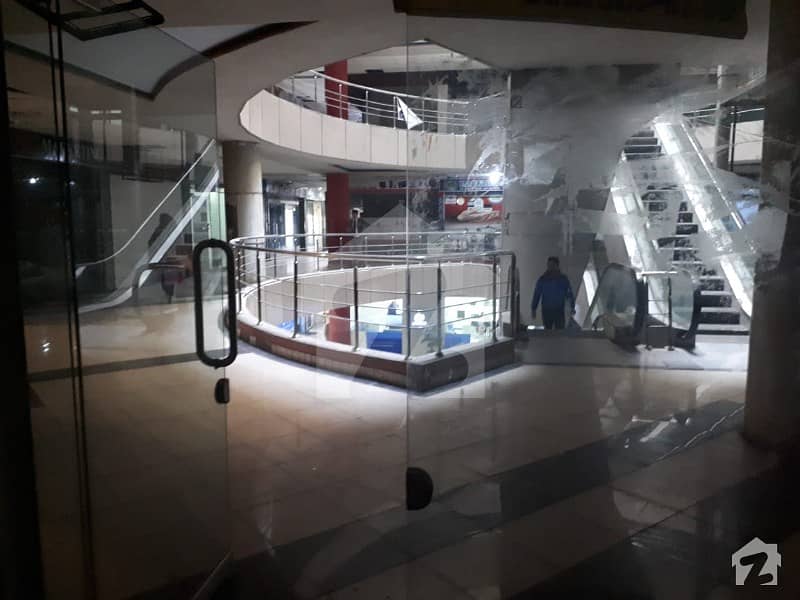
The height and width of the screenshot is (600, 800). In order to click on doors in this screenshot , I will do `click(146, 161)`, `click(466, 392)`.